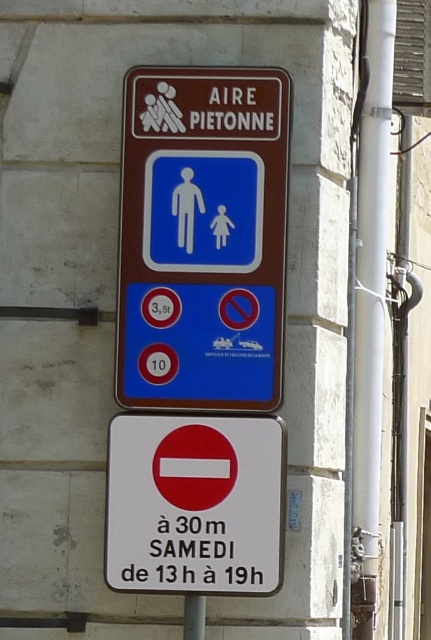
You are standing in front of a traffic signboard. You see a matte plastic sign at center and a white plastic pipe at right. Which object is located higher up?

The matte plastic sign at center is positioned over the white plastic pipe at right, so it is higher up.

You are a delivery person trying to navigate through a narrow alley. You see a white plastic sign at center and a white plastic pipe at right. Which object is shorter?

The white plastic sign at center is shorter than the white plastic pipe at right.